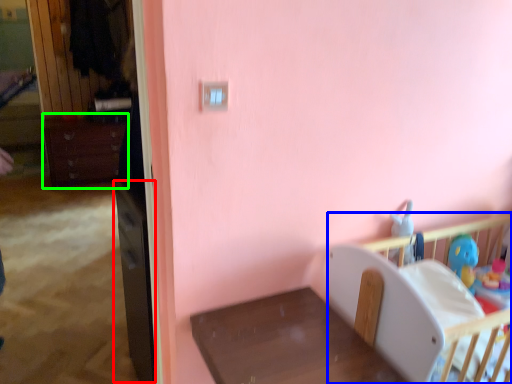
Question: Which object is positioned closest to file cabinet (highlighted by a red box)? Select from infant bed (highlighted by a blue box) and dresser (highlighted by a green box).

Choices:
 (A) infant bed
 (B) dresser

Answer: (A)